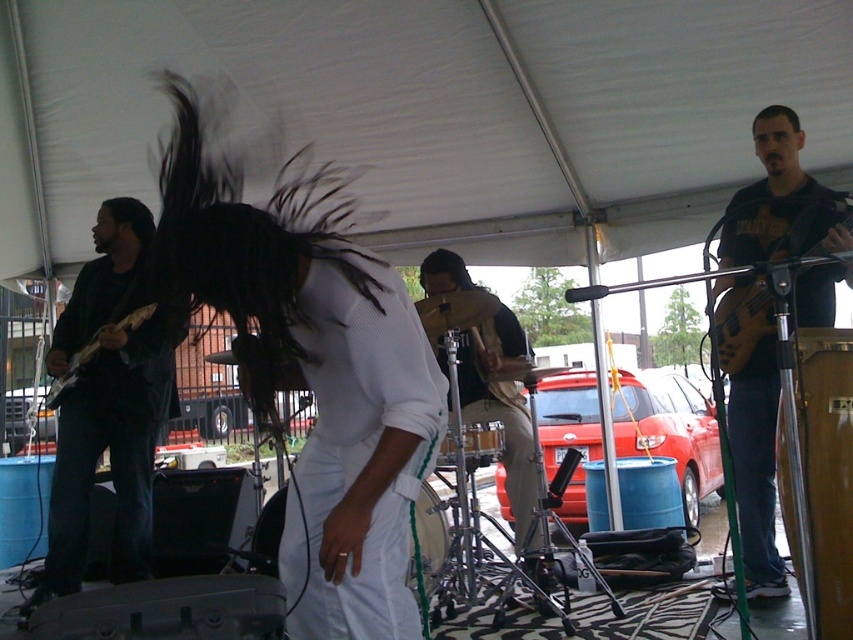
Question: Is matte black guitar at left positioned in front of black matte hair at upper right?

Choices:
 (A) no
 (B) yes

Answer: (B)

Question: Estimate the real-world distances between objects in this image. Which object is closer to the leather drum set at center?

Choices:
 (A) matte black electric guitar at left
 (B) matte black guitar at left
 (C) black matte hair at upper right

Answer: (B)

Question: Which object is farther from the camera taking this photo?

Choices:
 (A) matte brown electric guitar at right
 (B) matte black electric guitar at left
 (C) black matte hair at upper right
 (D) leather drum set at center

Answer: (D)

Question: Is leather drum set at center below matte black electric guitar at left?

Choices:
 (A) yes
 (B) no

Answer: (A)

Question: Can you confirm if matte black guitar at left is positioned below matte black electric guitar at left?

Choices:
 (A) yes
 (B) no

Answer: (A)

Question: Which of the following is the closest to the observer?

Choices:
 (A) leather drum set at center
 (B) matte brown electric guitar at right
 (C) matte black electric guitar at left

Answer: (B)